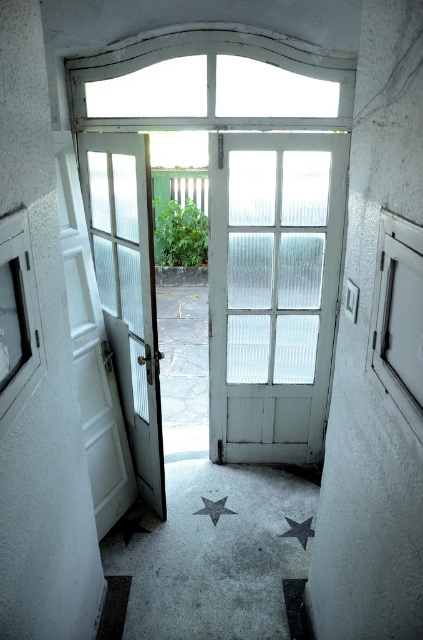
You are a delivery person holding a package that is 5 feet long. You need to slide it through the doorway without tilting it. Can you fit the package through the space between the white frosted glass door at center and the metallic star at lower center?

The distance between the white frosted glass door at center and the metallic star at lower center is 4.27 feet, which is shorter than the 5 feet long package. Therefore, the package cannot fit through the space without tilting.

You are standing in front of the door and want to locate the white frosted glass window at left. According to the coordinates provided, where exactly is it positioned?

The white frosted glass window at left is located at the 2D coordinates point (18, 317).